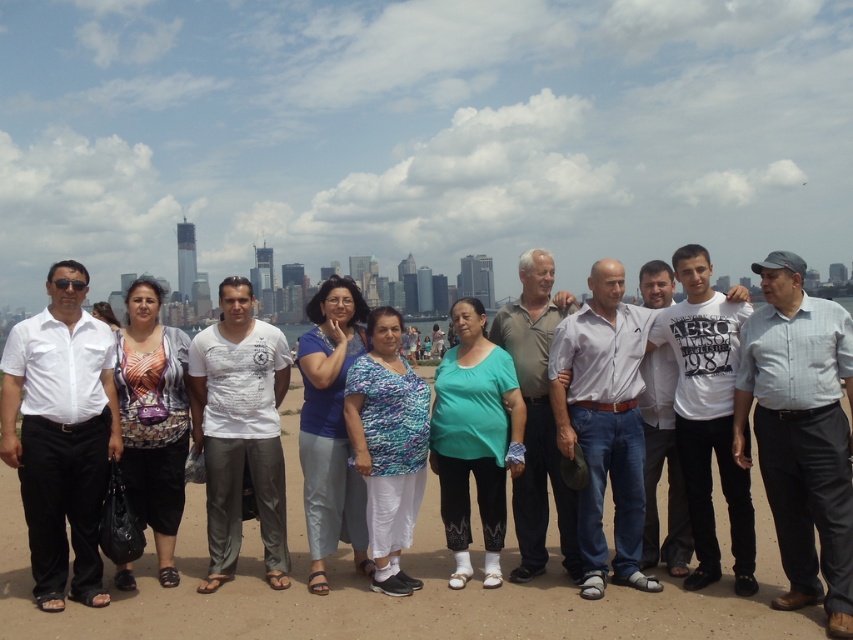
Locate an element on the screen. The height and width of the screenshot is (640, 853). gray cotton shirt at center is located at coordinates (801, 433).

The image size is (853, 640). Describe the element at coordinates (801, 433) in the screenshot. I see `gray cotton shirt at center` at that location.

Image resolution: width=853 pixels, height=640 pixels. In order to click on gray cotton shirt at center in this screenshot , I will do 801,433.

Who is taller, gray cotton shirt at center or white cotton shirt at center?

With more height is gray cotton shirt at center.

Can you confirm if gray cotton shirt at center is taller than white cotton shirt at center?

Yes, gray cotton shirt at center is taller than white cotton shirt at center.

Locate an element on the screen. Image resolution: width=853 pixels, height=640 pixels. gray cotton shirt at center is located at coordinates (801, 433).

Is printed fabric blouse at center above blue fabric pants at center?

Yes.

Does printed fabric blouse at center appear on the left side of blue fabric pants at center?

Indeed, printed fabric blouse at center is positioned on the left side of blue fabric pants at center.

Is point (172, 532) positioned before point (310, 589)?

That is False.

The height and width of the screenshot is (640, 853). In order to click on printed fabric blouse at center in this screenshot , I will do `click(154, 419)`.